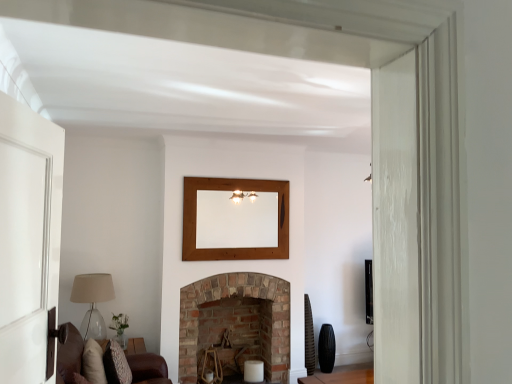
Locate an element on the screen. brick fireplace at center is located at coordinates (228, 296).

Describe the element at coordinates (92, 302) in the screenshot. I see `translucent glass lampshade at left` at that location.

This screenshot has width=512, height=384. What do you see at coordinates (236, 221) in the screenshot? I see `wooden mirror at upper center` at bounding box center [236, 221].

Locate an element on the screen. This screenshot has height=384, width=512. brick fireplace at center is located at coordinates (228, 296).

Which of these two, wooden mirror at upper center or brick fireplace at center, stands shorter?

Standing shorter between the two is wooden mirror at upper center.

Considering the relative positions of wooden mirror at upper center and brick fireplace at center in the image provided, is wooden mirror at upper center to the right of brick fireplace at center from the viewer's perspective?

Indeed, wooden mirror at upper center is positioned on the right side of brick fireplace at center.

Is wooden mirror at upper center with brick fireplace at center?

No, wooden mirror at upper center is not touching brick fireplace at center.

Considering the relative positions of wooden mirror at upper center and brick fireplace at center in the image provided, is wooden mirror at upper center in front of brick fireplace at center?

That is False.

Considering the sizes of brick fireplace at center and translucent glass lampshade at left in the image, is brick fireplace at center wider or thinner than translucent glass lampshade at left?

Clearly, brick fireplace at center has more width compared to translucent glass lampshade at left.

Could you tell me if brick fireplace at center is turned towards translucent glass lampshade at left?

No, brick fireplace at center is not facing towards translucent glass lampshade at left.

From a real-world perspective, is brick fireplace at center located beneath translucent glass lampshade at left?

Yes, from a real-world perspective, brick fireplace at center is beneath translucent glass lampshade at left.

The image size is (512, 384). In order to click on fireplace that appears behind the translucent glass lampshade at left in this screenshot , I will do `click(228, 296)`.

Is point (101, 328) farther from viewer compared to point (208, 197)?

No.

Find the location of `mirror above the translucent glass lampshade at left (from a real-world perspective)`. mirror above the translucent glass lampshade at left (from a real-world perspective) is located at coordinates (236, 221).

Consider the image. From a real-world perspective, which is physically below, translucent glass lampshade at left or wooden mirror at upper center?

translucent glass lampshade at left, from a real-world perspective.

What's the angular difference between translucent glass lampshade at left and wooden mirror at upper center's facing directions?

translucent glass lampshade at left and wooden mirror at upper center are facing 87.8 degrees away from each other.

I want to click on mirror above the brown leather couch at lower left (from the image's perspective), so click(x=236, y=221).

Is wooden mirror at upper center outside of brown leather couch at lower left?

Yes.

Would you say wooden mirror at upper center is a long distance from brown leather couch at lower left?

Yes, wooden mirror at upper center and brown leather couch at lower left are quite far apart.

Is wooden mirror at upper center in front of or behind translucent glass lampshade at left in the image?

Clearly, wooden mirror at upper center is behind translucent glass lampshade at left.

Is wooden mirror at upper center oriented towards translucent glass lampshade at left?

No, wooden mirror at upper center is not oriented towards translucent glass lampshade at left.

Is translucent glass lampshade at left a part of wooden mirror at upper center?

That's incorrect, translucent glass lampshade at left is not inside wooden mirror at upper center.

Is wooden mirror at upper center not close to translucent glass lampshade at left?

Yes, wooden mirror at upper center and translucent glass lampshade at left are quite far apart.

Is translucent glass lampshade at left positioned with its back to brick fireplace at center?

No, brick fireplace at center is not at the back of translucent glass lampshade at left.

Is translucent glass lampshade at left taller than brick fireplace at center?

No.

Does translucent glass lampshade at left appear on the left side of brick fireplace at center?

Indeed, translucent glass lampshade at left is positioned on the left side of brick fireplace at center.

Is point (138, 356) closer or farther from the camera than point (183, 293)?

Point (138, 356) is closer to the camera than point (183, 293).

From the image's perspective, does brown leather couch at lower left appear lower than brick fireplace at center?

No, from the image's perspective, brown leather couch at lower left is not beneath brick fireplace at center.

Which object is thinner, brown leather couch at lower left or brick fireplace at center?

Thinner between the two is brick fireplace at center.

Find the location of a particular element. This screenshot has width=512, height=384. mirror located above the brick fireplace at center (from the image's perspective) is located at coordinates (236, 221).

Find the location of a particular element. This screenshot has height=384, width=512. lamp that appears above the brick fireplace at center (from a real-world perspective) is located at coordinates (92, 302).

Looking at the image, which one is located further to wooden mirror at upper center, brick fireplace at center or brown leather couch at lower left?

brown leather couch at lower left lies further to wooden mirror at upper center than the other object.

Estimate the real-world distances between objects in this image. Which object is further from brown leather couch at lower left, brick fireplace at center or translucent glass lampshade at left?

Based on the image, brick fireplace at center appears to be further to brown leather couch at lower left.

Estimate the real-world distances between objects in this image. Which object is closer to brown leather couch at lower left, brick fireplace at center or wooden mirror at upper center?

Among the two, brick fireplace at center is located nearer to brown leather couch at lower left.

Which object lies further to the anchor point translucent glass lampshade at left, wooden mirror at upper center or brick fireplace at center?

wooden mirror at upper center is further to translucent glass lampshade at left.

Based on their spatial positions, is translucent glass lampshade at left or brick fireplace at center further from wooden mirror at upper center?

The object further to wooden mirror at upper center is translucent glass lampshade at left.

Estimate the real-world distances between objects in this image. Which object is further from wooden mirror at upper center, brick fireplace at center or translucent glass lampshade at left?

translucent glass lampshade at left is further to wooden mirror at upper center.

Looking at the image, which one is located further to translucent glass lampshade at left, brown leather couch at lower left or wooden mirror at upper center?

wooden mirror at upper center is positioned further to the anchor translucent glass lampshade at left.

When comparing their distances from wooden mirror at upper center, does brown leather couch at lower left or translucent glass lampshade at left seem closer?

translucent glass lampshade at left.

Where is `lamp between brown leather couch at lower left and brick fireplace at center from front to back`? Image resolution: width=512 pixels, height=384 pixels. lamp between brown leather couch at lower left and brick fireplace at center from front to back is located at coordinates (92, 302).

At what (x,y) coordinates should I click in order to perform the action: click on fireplace positioned between brown leather couch at lower left and wooden mirror at upper center from near to far. Please return your answer as a coordinate pair (x, y). The image size is (512, 384). Looking at the image, I should click on coord(228,296).

The image size is (512, 384). I want to click on fireplace between translucent glass lampshade at left and wooden mirror at upper center in the horizontal direction, so click(x=228, y=296).

Find the location of a particular element. lamp between brown leather couch at lower left and wooden mirror at upper center in the front-back direction is located at coordinates (92, 302).